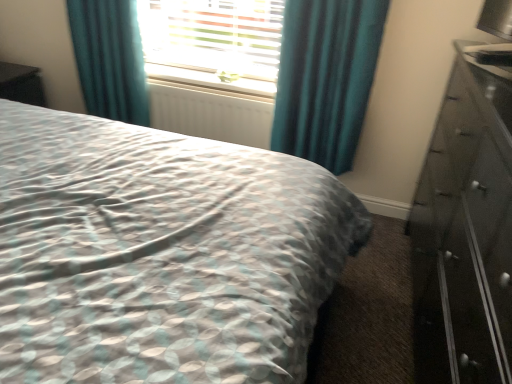
At what (x,y) coordinates should I click in order to perform the action: click on white plastic window sill at center. Please return your answer as a coordinate pair (x, y). The width and height of the screenshot is (512, 384). Looking at the image, I should click on (209, 80).

The width and height of the screenshot is (512, 384). In order to click on black glossy vanity at left in this screenshot , I will do `click(21, 84)`.

Identify the location of white textured radiator at center. (211, 113).

From the image's perspective, is white plastic window sill at center positioned above or below patterned fabric bed at center?

white plastic window sill at center is situated higher than patterned fabric bed at center in the image.

Based on the photo, can you confirm if white plastic window sill at center is smaller than patterned fabric bed at center?

Yes, white plastic window sill at center is smaller than patterned fabric bed at center.

From a real-world perspective, which is physically below, white plastic window sill at center or patterned fabric bed at center?

patterned fabric bed at center.

Is white plastic window sill at center at the left side of patterned fabric bed at center?

No.

Is black glossy vanity at left in front of or behind black glossy chest of drawers at right in the image?

Clearly, black glossy vanity at left is behind black glossy chest of drawers at right.

From the image's perspective, which is below, black glossy vanity at left or black glossy chest of drawers at right?

black glossy chest of drawers at right.

From a real-world perspective, is black glossy vanity at left above or below black glossy chest of drawers at right?

From a real-world perspective, black glossy vanity at left is physically below black glossy chest of drawers at right.

Considering the relative positions of white plastic window sill at center and teal fabric curtain at upper center, the first curtain from the right, in the image provided, is white plastic window sill at center to the left of teal fabric curtain at upper center, the first curtain from the right, from the viewer's perspective?

Indeed, white plastic window sill at center is positioned on the left side of teal fabric curtain at upper center, the first curtain from the right.

Is white plastic window sill at center next to teal fabric curtain at upper center, the first curtain from the right, and touching it?

No, white plastic window sill at center is not touching teal fabric curtain at upper center, the first curtain from the right.

Could you tell me if white plastic window sill at center is facing teal fabric curtain at upper center, the 2th curtain in the left-to-right sequence?

No, white plastic window sill at center is not oriented towards teal fabric curtain at upper center, the 2th curtain in the left-to-right sequence.

Measure the distance from teal fabric curtain at upper center, the first curtain from the right, to patterned fabric bed at center.

30.75 inches.

At what (x,y) coordinates should I click in order to perform the action: click on bed on the left of the teal fabric curtain at upper center, the first curtain from the right. Please return your answer as a coordinate pair (x, y). The height and width of the screenshot is (384, 512). Looking at the image, I should click on (160, 254).

Is teal fabric curtain at upper center, the first curtain from the right, taller or shorter than patterned fabric bed at center?

Considering their sizes, teal fabric curtain at upper center, the first curtain from the right, has less height than patterned fabric bed at center.

Is teal fabric curtain at upper center, the 2th curtain in the left-to-right sequence, facing away from patterned fabric bed at center?

No, patterned fabric bed at center is not at the back of teal fabric curtain at upper center, the 2th curtain in the left-to-right sequence.

Does black glossy vanity at left lie behind teal velvet curtain at upper left, the second curtain from the right?

Yes, it is.

In order to click on the 1st curtain in front of the black glossy vanity at left, starting your count from the anchor in this screenshot , I will do `click(110, 59)`.

Consider the image. How many degrees apart are the facing directions of black glossy vanity at left and teal velvet curtain at upper left, the 1th curtain in the left-to-right sequence?

They differ by 92.1 degrees in their facing directions.

Considering the sizes of objects black glossy vanity at left and teal velvet curtain at upper left, the second curtain from the right, in the image provided, who is smaller, black glossy vanity at left or teal velvet curtain at upper left, the second curtain from the right,?

With smaller size is black glossy vanity at left.

Is teal fabric curtain at upper center, the 2th curtain in the left-to-right sequence, positioned with its back to teal velvet curtain at upper left, the second curtain from the right?

That's not correct — teal fabric curtain at upper center, the 2th curtain in the left-to-right sequence, is not looking away from teal velvet curtain at upper left, the second curtain from the right.

Consider the image. In terms of height, does teal fabric curtain at upper center, the 2th curtain in the left-to-right sequence, look taller or shorter compared to teal velvet curtain at upper left, the 1th curtain in the left-to-right sequence?

teal fabric curtain at upper center, the 2th curtain in the left-to-right sequence, is taller than teal velvet curtain at upper left, the 1th curtain in the left-to-right sequence.

Between teal fabric curtain at upper center, the first curtain from the right, and teal velvet curtain at upper left, the second curtain from the right, which one has smaller width?

teal velvet curtain at upper left, the second curtain from the right, is thinner.

Would you say teal fabric curtain at upper center, the 2th curtain in the left-to-right sequence, is to the left or to the right of teal velvet curtain at upper left, the 1th curtain in the left-to-right sequence, in the picture?

Clearly, teal fabric curtain at upper center, the 2th curtain in the left-to-right sequence, is on the right of teal velvet curtain at upper left, the 1th curtain in the left-to-right sequence, in the image.

Can you confirm if teal fabric curtain at upper center, the first curtain from the right, is thinner than black glossy chest of drawers at right?

Indeed, teal fabric curtain at upper center, the first curtain from the right, has a lesser width compared to black glossy chest of drawers at right.

Which is more to the left, teal fabric curtain at upper center, the first curtain from the right, or black glossy chest of drawers at right?

From the viewer's perspective, teal fabric curtain at upper center, the first curtain from the right, appears more on the left side.

Does teal fabric curtain at upper center, the 2th curtain in the left-to-right sequence, have a greater height compared to black glossy chest of drawers at right?

In fact, teal fabric curtain at upper center, the 2th curtain in the left-to-right sequence, may be shorter than black glossy chest of drawers at right.

How different are the orientations of teal fabric curtain at upper center, the first curtain from the right, and black glossy chest of drawers at right in degrees?

88.5 degrees.

You are a GUI agent. You are given a task and a screenshot of the screen. Output one action in this format:
    pyautogui.click(x=<x>, y=<y>)
    Task: Click on the bed that is in front of the white plastic window sill at center
    Image resolution: width=512 pixels, height=384 pixels.
    Given the screenshot: What is the action you would take?
    pyautogui.click(x=160, y=254)

Identify the location of vanity below the black glossy chest of drawers at right (from a real-world perspective). The width and height of the screenshot is (512, 384). (21, 84).

Based on their spatial positions, is white textured radiator at center or patterned fabric bed at center further from teal fabric curtain at upper center, the first curtain from the right?

The object further to teal fabric curtain at upper center, the first curtain from the right, is patterned fabric bed at center.

Looking at this image, estimate the real-world distances between objects in this image. Which object is further from patterned fabric bed at center, white plastic window sill at center or white textured radiator at center?

Among the two, white plastic window sill at center is located further to patterned fabric bed at center.

Looking at the image, which one is located further to white textured radiator at center, black glossy vanity at left or teal velvet curtain at upper left, the 1th curtain in the left-to-right sequence?

Based on the image, black glossy vanity at left appears to be further to white textured radiator at center.

Considering their positions, is white textured radiator at center positioned further to white plastic window sill at center than black glossy chest of drawers at right?

black glossy chest of drawers at right is further to white plastic window sill at center.

When comparing their distances from teal velvet curtain at upper left, the second curtain from the right, does white textured radiator at center or white plastic window sill at center seem closer?

Based on the image, white textured radiator at center appears to be nearer to teal velvet curtain at upper left, the second curtain from the right.

Which object lies nearer to the anchor point black glossy vanity at left, patterned fabric bed at center or black glossy chest of drawers at right?

patterned fabric bed at center is closer to black glossy vanity at left.

Estimate the real-world distances between objects in this image. Which object is closer to black glossy vanity at left, teal velvet curtain at upper left, the second curtain from the right, or black glossy chest of drawers at right?

Based on the image, teal velvet curtain at upper left, the second curtain from the right, appears to be nearer to black glossy vanity at left.

Estimate the real-world distances between objects in this image. Which object is closer to white textured radiator at center, teal fabric curtain at upper center, the first curtain from the right, or black glossy vanity at left?

teal fabric curtain at upper center, the first curtain from the right, is positioned closer to the anchor white textured radiator at center.

The image size is (512, 384). In order to click on window sill between teal velvet curtain at upper left, the second curtain from the right, and white textured radiator at center in this screenshot , I will do `click(209, 80)`.

Locate an element on the screen. This screenshot has height=384, width=512. curtain between teal velvet curtain at upper left, the second curtain from the right, and black glossy chest of drawers at right is located at coordinates (326, 78).

You are a GUI agent. You are given a task and a screenshot of the screen. Output one action in this format:
    pyautogui.click(x=<x>, y=<y>)
    Task: Click on the radiator situated between black glossy vanity at left and teal fabric curtain at upper center, the 2th curtain in the left-to-right sequence, from left to right
    Image resolution: width=512 pixels, height=384 pixels.
    Given the screenshot: What is the action you would take?
    pyautogui.click(x=211, y=113)

Find the location of a particular element. chest of drawers between patterned fabric bed at center and teal velvet curtain at upper left, the 1th curtain in the left-to-right sequence, along the z-axis is located at coordinates (465, 232).